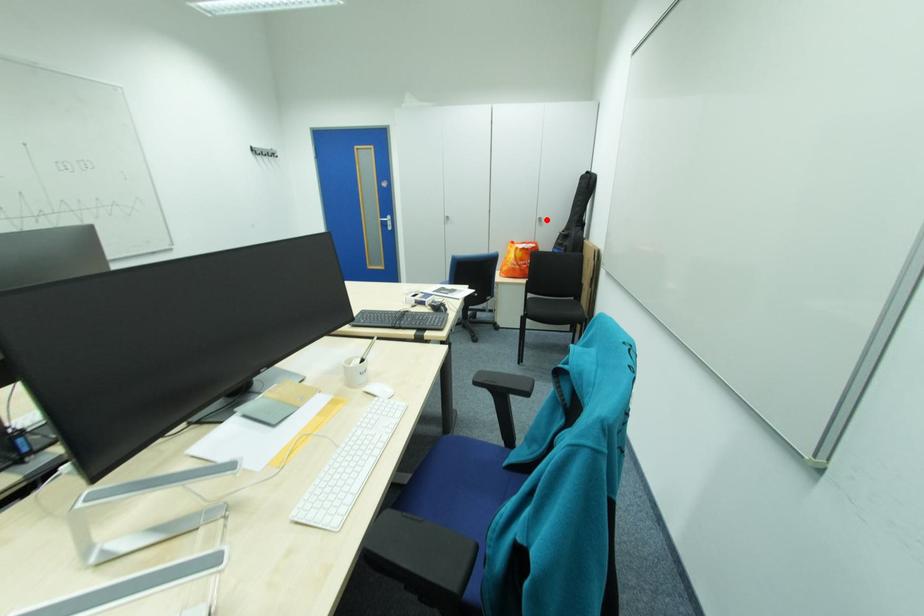
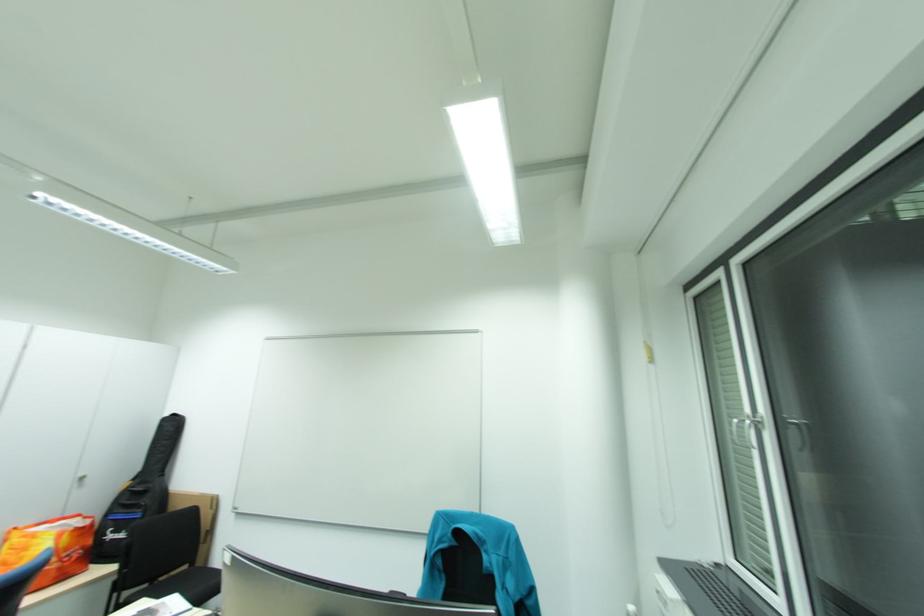
Question: I am providing you with two images of the same scene from different viewpoints. A red point is marked on the first image. Is the red point's position out of view in image 2?

Choices:
 (A) Yes
 (B) No

Answer: (B)